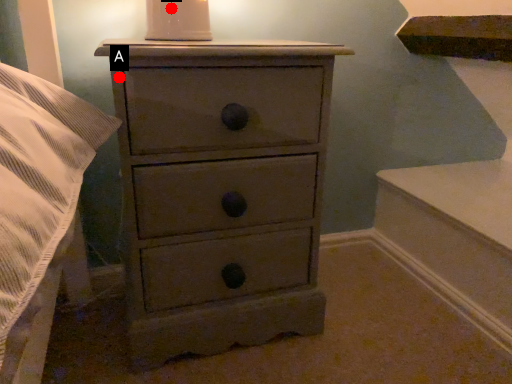
Question: Two points are circled on the image, labeled by A and B beside each circle. Which point is further to the camera?

Choices:
 (A) A is further
 (B) B is further

Answer: (B)